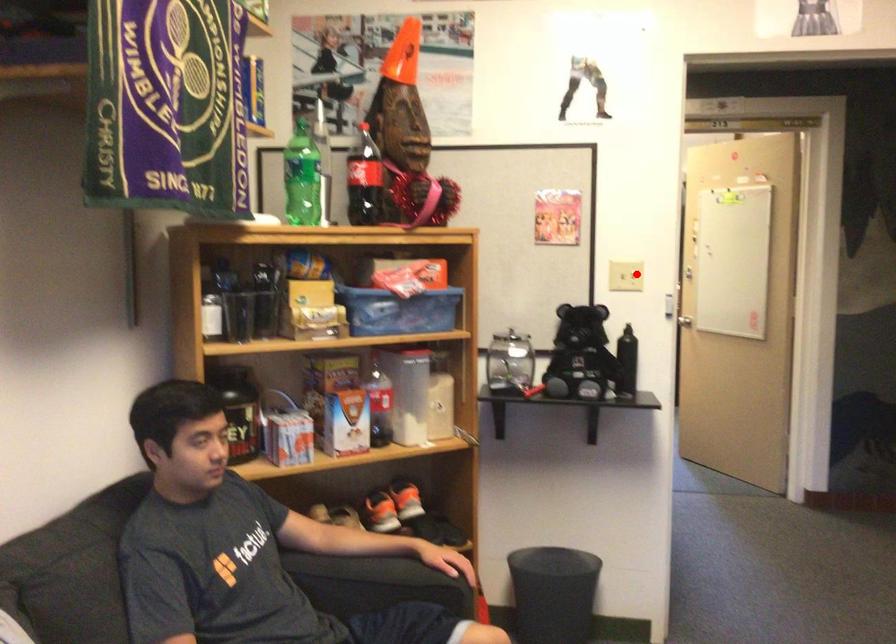
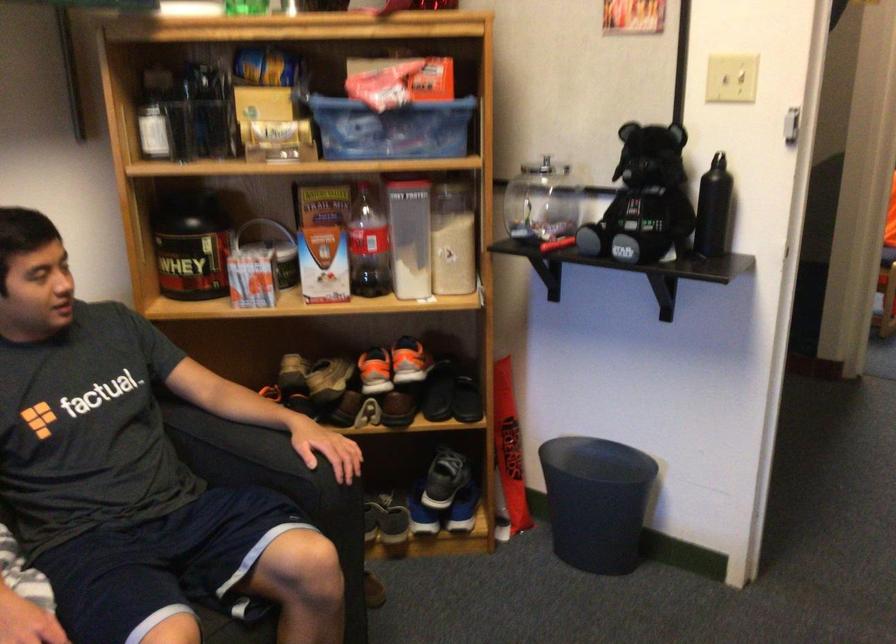
The point at the highlighted location is marked in the first image. Where is the corresponding point in the second image?

(730, 78)